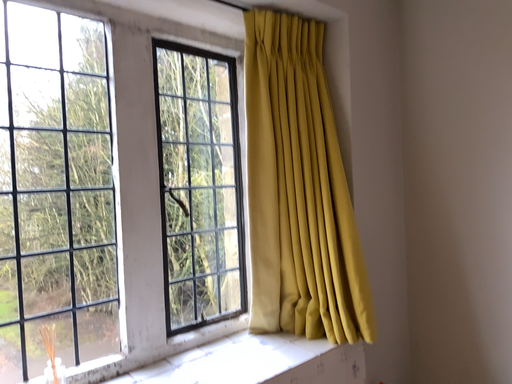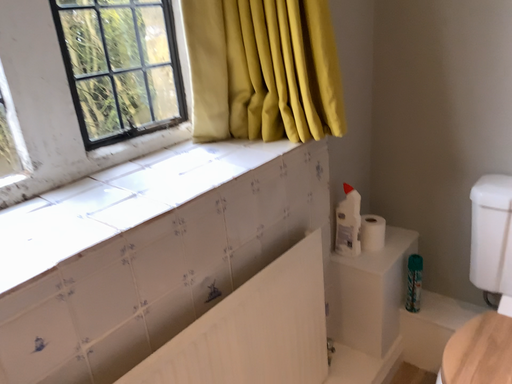
Question: Which way did the camera rotate in the video?

Choices:
 (A) rotated upward
 (B) rotated downward

Answer: (B)